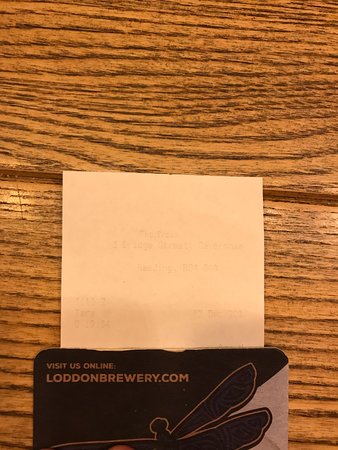
Locate an element on the screen. Image resolution: width=338 pixels, height=450 pixels. wood table is located at coordinates (289, 286).